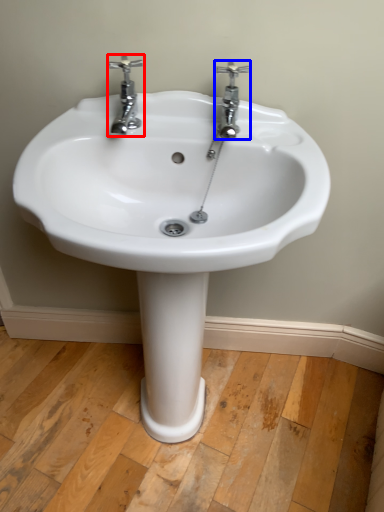
Question: Which point is further to the camera, tap (highlighted by a red box) or tap (highlighted by a blue box)?

Choices:
 (A) tap
 (B) tap

Answer: (B)